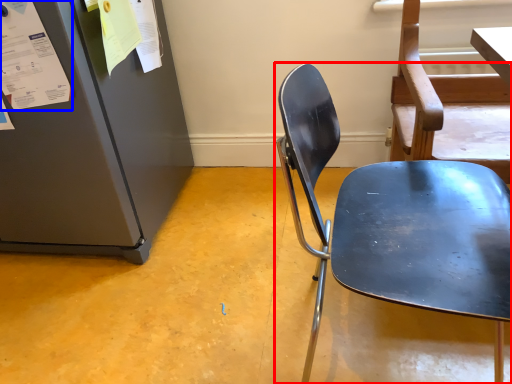
Question: Which of the following is the farthest to the observer, chair (highlighted by a red box) or paper (highlighted by a blue box)?

Choices:
 (A) chair
 (B) paper

Answer: (B)